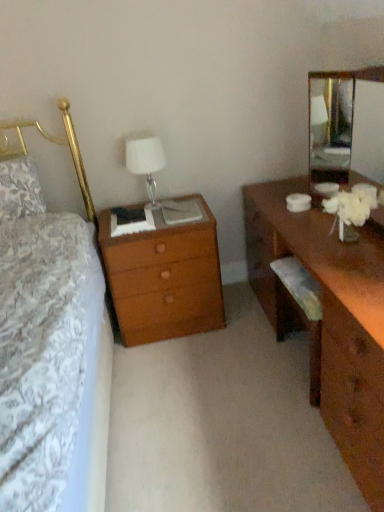
What do you see at coordinates (164, 278) in the screenshot? This screenshot has height=512, width=384. I see `wooden nightstand at left` at bounding box center [164, 278].

At what (x,y) coordinates should I click in order to perform the action: click on clear glass mirror at upper right. Please return your answer as a coordinate pair (x, y). The height and width of the screenshot is (512, 384). Looking at the image, I should click on (334, 121).

You are a GUI agent. You are given a task and a screenshot of the screen. Output one action in this format:
    pyautogui.click(x=<x>, y=<y>)
    Task: Click on the wooden nightstand at left
    The width and height of the screenshot is (384, 512).
    Given the screenshot: What is the action you would take?
    [x=164, y=278]

Considering the sizes of white fabric lampshade at upper center and fluffy white pillow at left in the image, is white fabric lampshade at upper center bigger or smaller than fluffy white pillow at left?

Clearly, white fabric lampshade at upper center is smaller in size than fluffy white pillow at left.

Which of these two, white fabric lampshade at upper center or fluffy white pillow at left, stands shorter?

Standing shorter between the two is fluffy white pillow at left.

From the image's perspective, who appears lower, white fabric lampshade at upper center or fluffy white pillow at left?

fluffy white pillow at left is shown below in the image.

Which is more to the left, wooden nightstand at left or fluffy white pillow at left?

From the viewer's perspective, fluffy white pillow at left appears more on the left side.

Image resolution: width=384 pixels, height=512 pixels. What are the coordinates of `pillow on the left side of wooden nightstand at left` in the screenshot? It's located at (20, 189).

Is fluffy white pillow at left completely or partially inside wooden nightstand at left?

No, wooden nightstand at left does not contain fluffy white pillow at left.

Is wooden nightstand at left taller or shorter than fluffy white pillow at left?

Considering their sizes, wooden nightstand at left has more height than fluffy white pillow at left.

From the image's perspective, which object appears higher, clear glass mirror at upper right or brown wooden desk at right?

clear glass mirror at upper right is shown above in the image.

From a real-world perspective, is clear glass mirror at upper right located higher than brown wooden desk at right?

Indeed, from a real-world perspective, clear glass mirror at upper right stands above brown wooden desk at right.

Can you tell me how much clear glass mirror at upper right and brown wooden desk at right differ in facing direction?

The facing directions of clear glass mirror at upper right and brown wooden desk at right are 0.327 degrees apart.

Which is behind, point (318, 119) or point (351, 378)?

The point (318, 119) is farther.

Looking at this image, from a real-world perspective, is fluffy white pillow at left above or below white fabric lampshade at upper center?

Clearly, from a real-world perspective, fluffy white pillow at left is above white fabric lampshade at upper center.

Does fluffy white pillow at left have a lesser height compared to white fabric lampshade at upper center?

Yes.

Between fluffy white pillow at left and white fabric lampshade at upper center, which one has larger size?

fluffy white pillow at left.

Considering the sizes of objects wooden nightstand at left and clear glass mirror at upper right in the image provided, who is shorter, wooden nightstand at left or clear glass mirror at upper right?

clear glass mirror at upper right.

Locate an element on the screen. The width and height of the screenshot is (384, 512). mirror that is above the wooden nightstand at left (from the image's perspective) is located at coordinates (334, 121).

Considering the relative sizes of wooden nightstand at left and clear glass mirror at upper right in the image provided, is wooden nightstand at left thinner than clear glass mirror at upper right?

Incorrect, the width of wooden nightstand at left is not less than that of clear glass mirror at upper right.

Is wooden nightstand at left inside or outside of white fabric lampshade at upper center?

wooden nightstand at left cannot be found inside white fabric lampshade at upper center.

From the image's perspective, between wooden nightstand at left and white fabric lampshade at upper center, which one is located above?

white fabric lampshade at upper center.

From a real-world perspective, between wooden nightstand at left and white fabric lampshade at upper center, who is vertically lower?

wooden nightstand at left, from a real-world perspective.

Looking at this image, which of these two, wooden nightstand at left or white fabric lampshade at upper center, is wider?

wooden nightstand at left is wider.

Considering the sizes of objects clear glass mirror at upper right and wooden nightstand at left in the image provided, who is bigger, clear glass mirror at upper right or wooden nightstand at left?

wooden nightstand at left.

From the image's perspective, is clear glass mirror at upper right above or below wooden nightstand at left?

clear glass mirror at upper right is situated higher than wooden nightstand at left in the image.

Does clear glass mirror at upper right contain wooden nightstand at left?

No, wooden nightstand at left is not inside clear glass mirror at upper right.

Is clear glass mirror at upper right closer to camera compared to wooden nightstand at left?

Yes, the depth of clear glass mirror at upper right is less than that of wooden nightstand at left.

I want to click on table lamp above the fluffy white pillow at left (from the image's perspective), so click(x=146, y=162).

The width and height of the screenshot is (384, 512). In order to click on nightstand behind the fluffy white pillow at left in this screenshot , I will do point(164,278).

Which object lies nearer to the anchor point wooden nightstand at left, fluffy white pillow at left or white fabric lampshade at upper center?

white fabric lampshade at upper center is positioned closer to the anchor wooden nightstand at left.

Considering their positions, is fluffy white pillow at left positioned further to brown wooden desk at right than clear glass mirror at upper right?

The object further to brown wooden desk at right is fluffy white pillow at left.

Based on their spatial positions, is clear glass mirror at upper right or wooden nightstand at left further from white fabric lampshade at upper center?

clear glass mirror at upper right is positioned further to the anchor white fabric lampshade at upper center.

Looking at the image, which one is located further to fluffy white pillow at left, brown wooden desk at right or wooden nightstand at left?

brown wooden desk at right.

Estimate the real-world distances between objects in this image. Which object is further from clear glass mirror at upper right, white fabric lampshade at upper center or wooden nightstand at left?

The object further to clear glass mirror at upper right is wooden nightstand at left.

Considering their positions, is fluffy white pillow at left positioned further to clear glass mirror at upper right than white fabric lampshade at upper center?

fluffy white pillow at left is positioned further to the anchor clear glass mirror at upper right.

Looking at the image, which one is located further to brown wooden desk at right, clear glass mirror at upper right or wooden nightstand at left?

Among the two, clear glass mirror at upper right is located further to brown wooden desk at right.

From the picture: Based on their spatial positions, is wooden nightstand at left or white fabric lampshade at upper center further from clear glass mirror at upper right?

wooden nightstand at left is positioned further to the anchor clear glass mirror at upper right.

Where is `nightstand between white fabric lampshade at upper center and clear glass mirror at upper right from left to right`? This screenshot has height=512, width=384. nightstand between white fabric lampshade at upper center and clear glass mirror at upper right from left to right is located at coordinates (164, 278).

At what (x,y) coordinates should I click in order to perform the action: click on table lamp located between fluffy white pillow at left and wooden nightstand at left in the left-right direction. Please return your answer as a coordinate pair (x, y). Image resolution: width=384 pixels, height=512 pixels. Looking at the image, I should click on (146, 162).

You are a GUI agent. You are given a task and a screenshot of the screen. Output one action in this format:
    pyautogui.click(x=<x>, y=<y>)
    Task: Click on the desk located between fluffy white pillow at left and clear glass mirror at upper right in the left-right direction
    The image size is (384, 512).
    Given the screenshot: What is the action you would take?
    pyautogui.click(x=329, y=317)

Where is `table lamp between fluffy white pillow at left and clear glass mirror at upper right`? table lamp between fluffy white pillow at left and clear glass mirror at upper right is located at coordinates (146, 162).